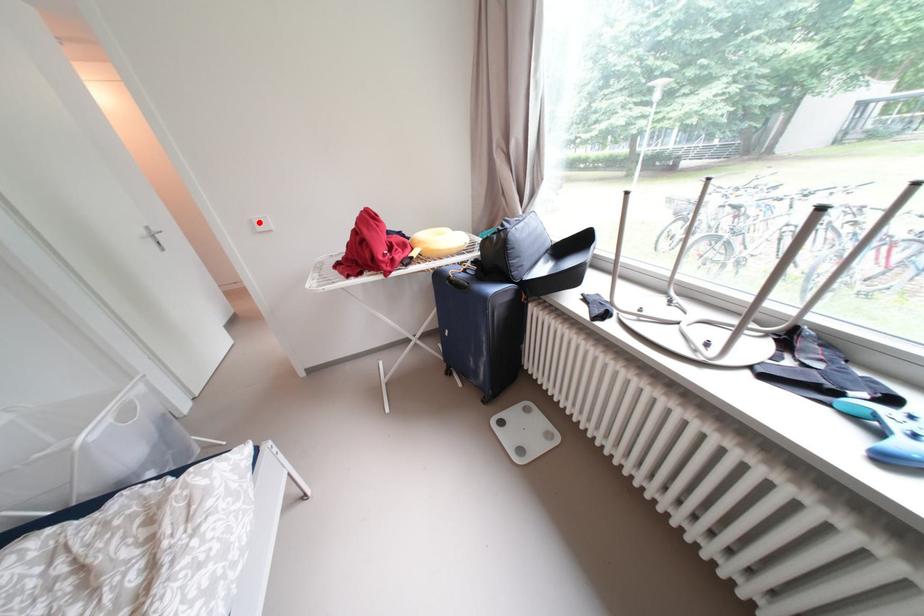
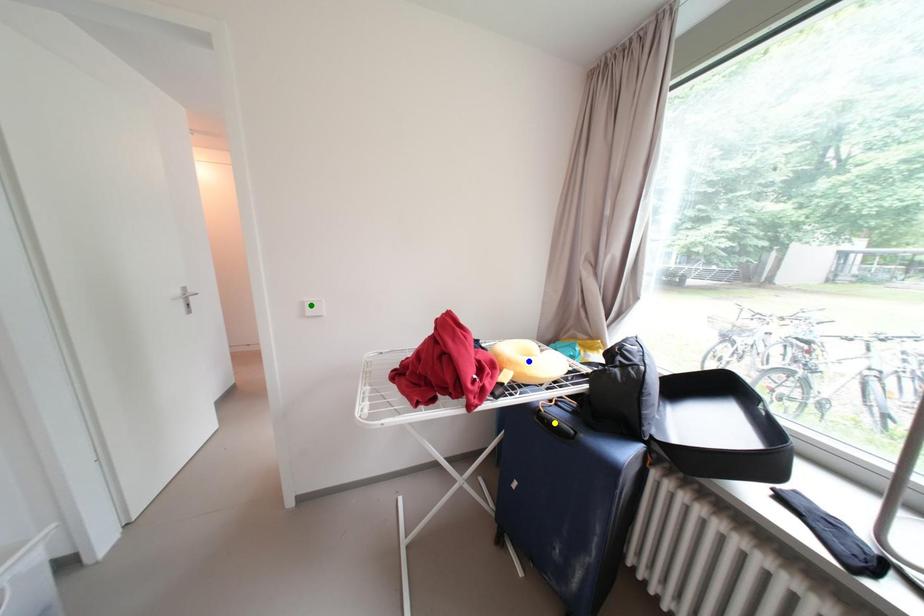
Question: I am providing you with two images of the same scene from different viewpoints. A red point is marked on the first image. You are given multiple points on the second image. Which mark in image 2 goes with the point in image 1?

Choices:
 (A) green point
 (B) yellow point
 (C) blue point

Answer: (A)